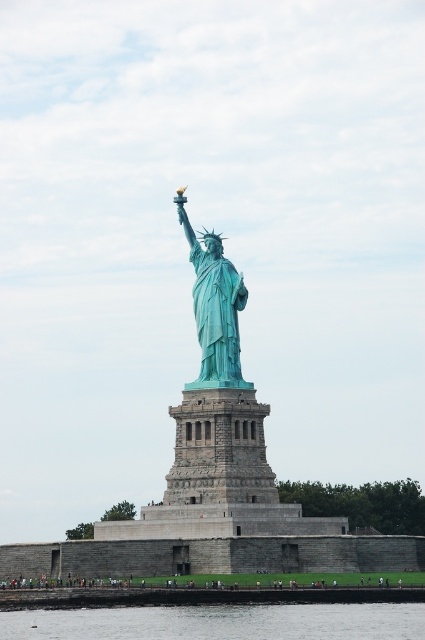
Is point (189, 636) closer to viewer compared to point (206, 339)?

Yes, point (189, 636) is closer to viewer.

Who is positioned more to the left, clear water at lower center or green patina statue at center?

From the viewer's perspective, clear water at lower center appears more on the left side.

Is point (184, 620) closer to camera compared to point (232, 312)?

Yes, point (184, 620) is in front of point (232, 312).

I want to click on clear water at lower center, so click(x=220, y=621).